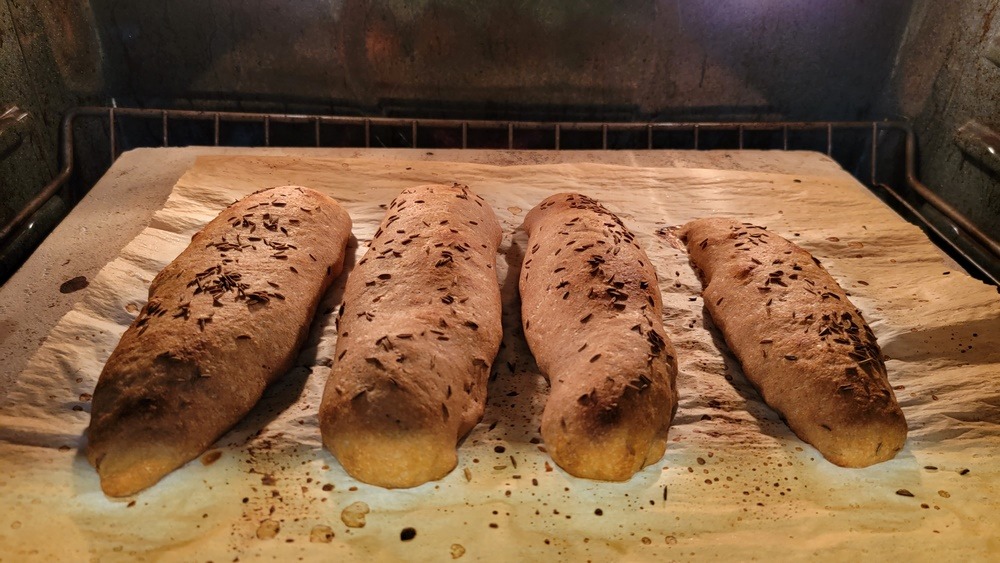
Image resolution: width=1000 pixels, height=563 pixels. In order to click on left wall of oven in this screenshot , I will do `click(28, 71)`.